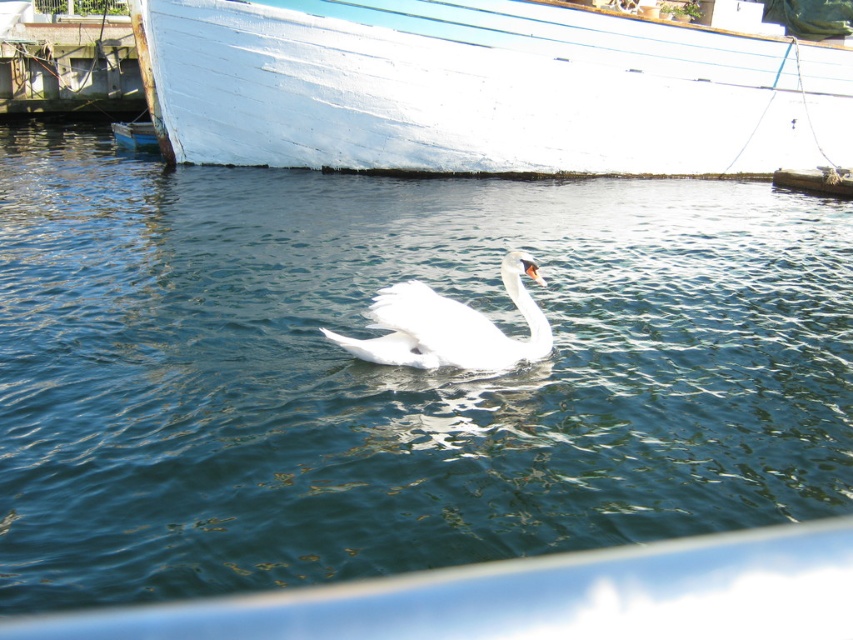
You are standing at the camera position and want to take a photo of the white matte boat at upper center. If your camera has a maximum zoom range of 10 meters, will you be able to capture the boat clearly without moving closer?

The white matte boat at upper center and camera are 14.09 meters apart from each other. Since the maximum zoom range is 10 meters, the camera cannot capture the boat clearly without moving closer.

You are standing on the dock and see the white matte boat at upper center and the white feathered swan at center. Which object is positioned to the right side of the other?

The white matte boat at upper center is to the right of the white feathered swan at center.

You are standing at the center of the image and want to walk towards the point labeled as point [784,163]. However, there is an obstacle at point [489,358]. Will you encounter the obstacle before reaching your destination?

Yes, you will encounter the obstacle at point [489,358] before reaching point [784,163] because point [784,163] is behind point [489,358].